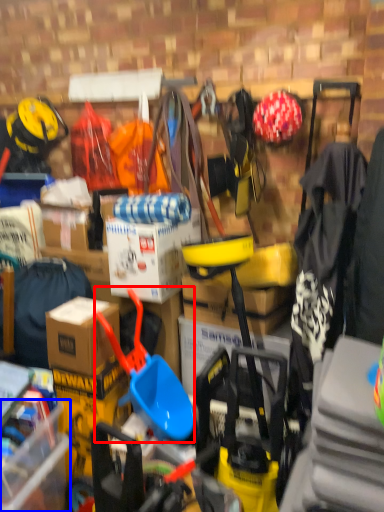
Question: Which object is further to the camera taking this photo, shovel (highlighted by a red box) or storage box (highlighted by a blue box)?

Choices:
 (A) shovel
 (B) storage box

Answer: (A)